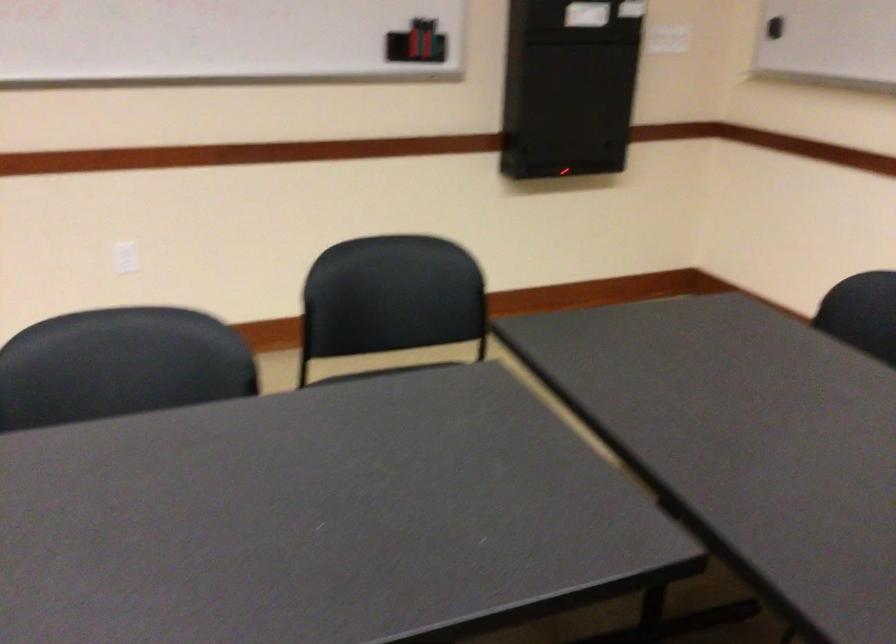
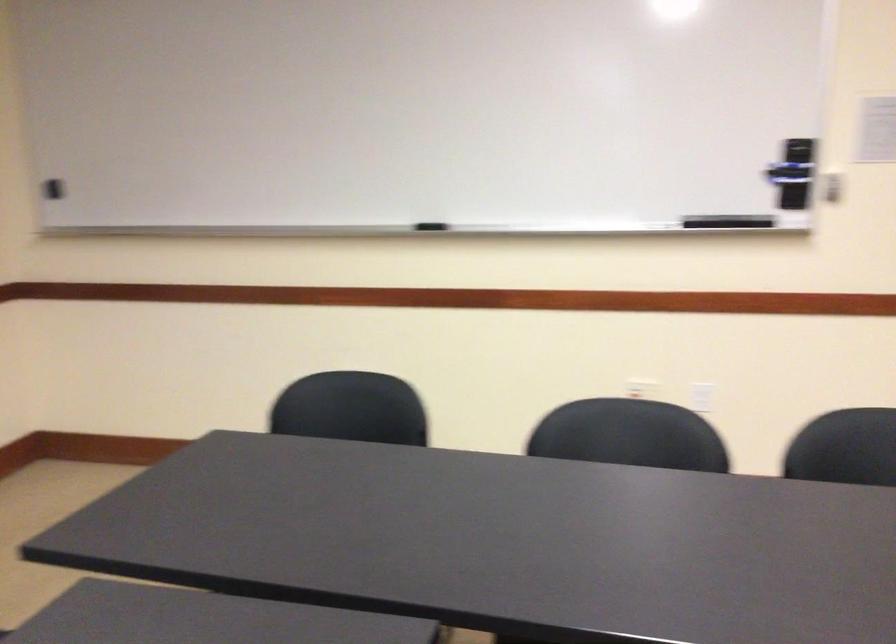
Question: How did the camera likely rotate?

Choices:
 (A) Left
 (B) Right
 (C) Up
 (D) Down

Answer: (B)